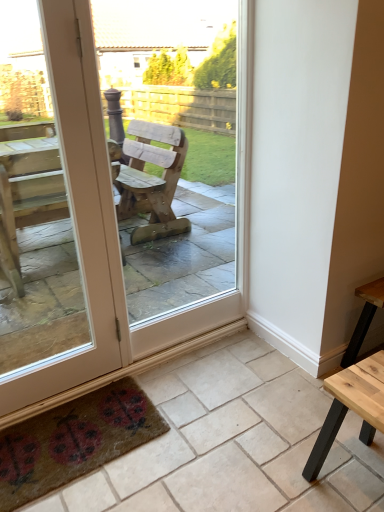
In order to click on vacant space situated above textured brown mat with ladybugs at lower left (from a real-world perspective) in this screenshot , I will do `click(78, 430)`.